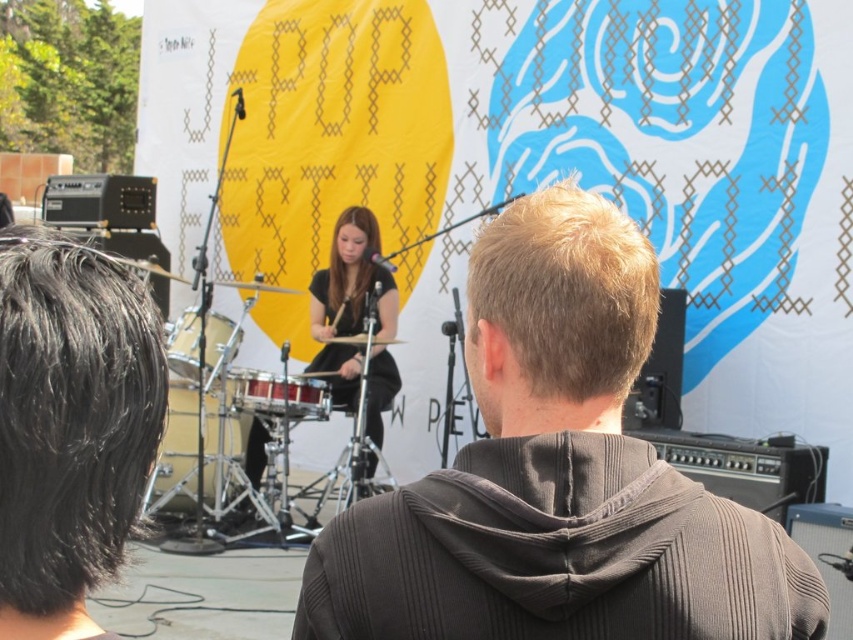
You are a photographer at the event and want to capture both the gray corduroy hoodie at center and the matte black drum set at center in the same frame. Based on their positions, which object should you position closer to the left side of your camera viewfinder?

The matte black drum set at center should be positioned closer to the left side of the camera viewfinder since the gray corduroy hoodie at center is to the right of it.

You are a stagehand at the music event and need to adjust the drum positions. The shiny silver drum at center and the shiny red drum at center are both on the stage. Which one is positioned lower?

A: The shiny silver drum at center is below the shiny red drum at center, so the shiny silver drum at center is positioned lower.

You are standing at the front of the stage where the matte black drum set at center is located. You need to pass a note to a bandmate who is 24.31 feet away. Is this distance within the typical range for passing items by hand without throwing?

The distance between you and your bandmate is 24.31 feet. Typically, passing items by hand without throwing is comfortable up to about 10 feet. Therefore, you would need to either move closer or throw the note to reach them.